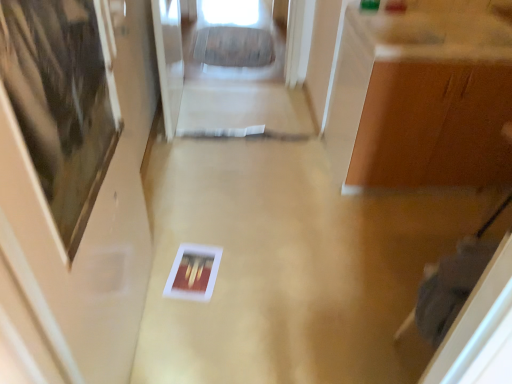
You are a GUI agent. You are given a task and a screenshot of the screen. Output one action in this format:
    pyautogui.click(x=<x>, y=<y>)
    Task: Click on the vacant space underneath matte brown cabinet at upper right (from a real-world perspective)
    The image size is (512, 384).
    Given the screenshot: What is the action you would take?
    pyautogui.click(x=380, y=206)